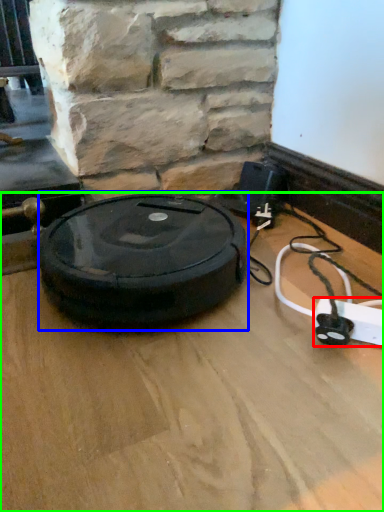
Question: Based on their relative distances, which object is farther from extension cord (highlighted by a red box)? Choose from car tire (highlighted by a blue box) and surface (highlighted by a green box).

Choices:
 (A) car tire
 (B) surface

Answer: (A)